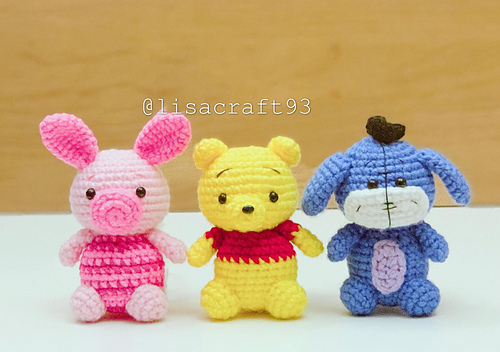
Locate an element on the screen. The width and height of the screenshot is (500, 352). floor is located at coordinates (480, 305).